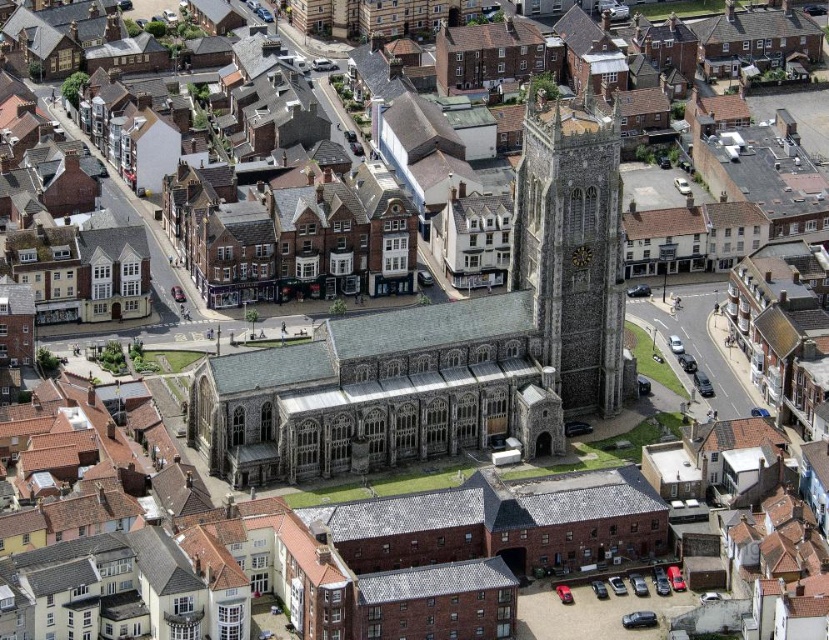
Does stone church at center have a lesser width compared to stone clock tower at center?

No.

Between stone church at center and stone clock tower at center, which one appears on the left side from the viewer's perspective?

Positioned to the left is stone church at center.

Is point (211, 412) closer to camera compared to point (609, 344)?

That is True.

At what (x,y) coordinates should I click in order to perform the action: click on stone church at center. Please return your answer as a coordinate pair (x, y). The height and width of the screenshot is (640, 829). Looking at the image, I should click on (449, 340).